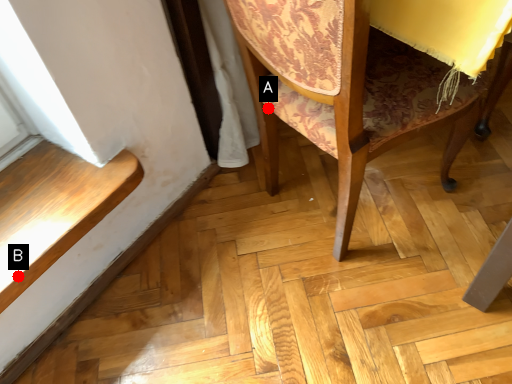
Question: Two points are circled on the image, labeled by A and B beside each circle. Which point is closer to the camera?

Choices:
 (A) A is closer
 (B) B is closer

Answer: (B)